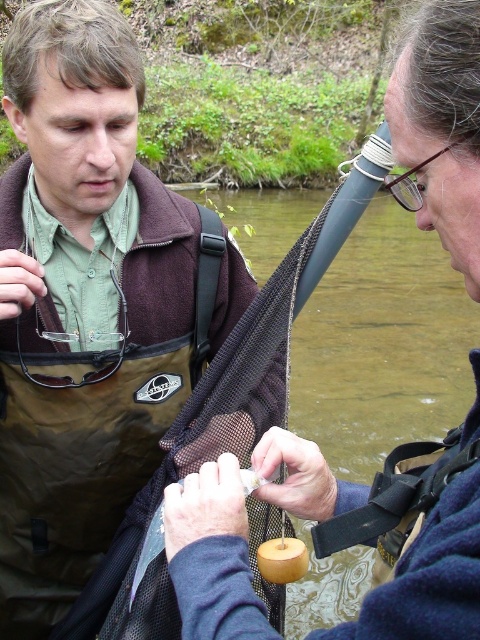
Between matte black vest at center and matte black vest at left, which one has less height?

matte black vest at left

Does matte black vest at center have a lesser height compared to matte black vest at left?

No.

Is point (27, 67) in front of point (168, 538)?

No, it is behind (168, 538).

This screenshot has height=640, width=480. Find the location of `matte black vest at center`. matte black vest at center is located at coordinates (90, 305).